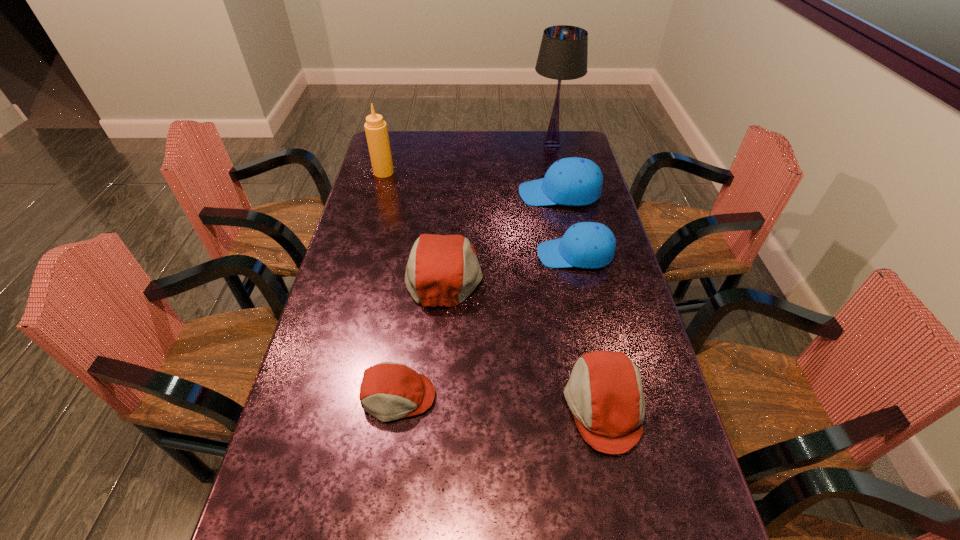
You are a GUI agent. You are given a task and a screenshot of the screen. Output one action in this format:
    pyautogui.click(x=<x>, y=<y>)
    Task: Click on the object present at the far right corner
    This screenshot has width=960, height=540.
    Given the screenshot: What is the action you would take?
    pyautogui.click(x=563, y=53)

Locate an element on the screen. free spot at the far edge of the desktop is located at coordinates tap(426, 149).

Where is `free spot at the left edge of the desktop`? free spot at the left edge of the desktop is located at coordinates coord(337,336).

Find the location of a particular element. The image size is (960, 540). blank space at the right edge of the desktop is located at coordinates (632, 297).

Find the location of `vacant region at the far left corner of the desktop`. vacant region at the far left corner of the desktop is located at coordinates (409, 158).

This screenshot has width=960, height=540. In order to click on vacant space at the far right corner in this screenshot , I will do `click(572, 144)`.

The height and width of the screenshot is (540, 960). Find the location of `free spot between the biggest red cap and the second smallest red cap`. free spot between the biggest red cap and the second smallest red cap is located at coordinates (524, 339).

This screenshot has height=540, width=960. Find the location of `empty location between the smallest red cap and the biggest red cap`. empty location between the smallest red cap and the biggest red cap is located at coordinates (421, 334).

Find the location of `vacant area that lies between the rightmost red cap and the biggest red cap`. vacant area that lies between the rightmost red cap and the biggest red cap is located at coordinates (524, 339).

I want to click on free space between the fifth nearest object and the nearer blue cap, so click(x=567, y=224).